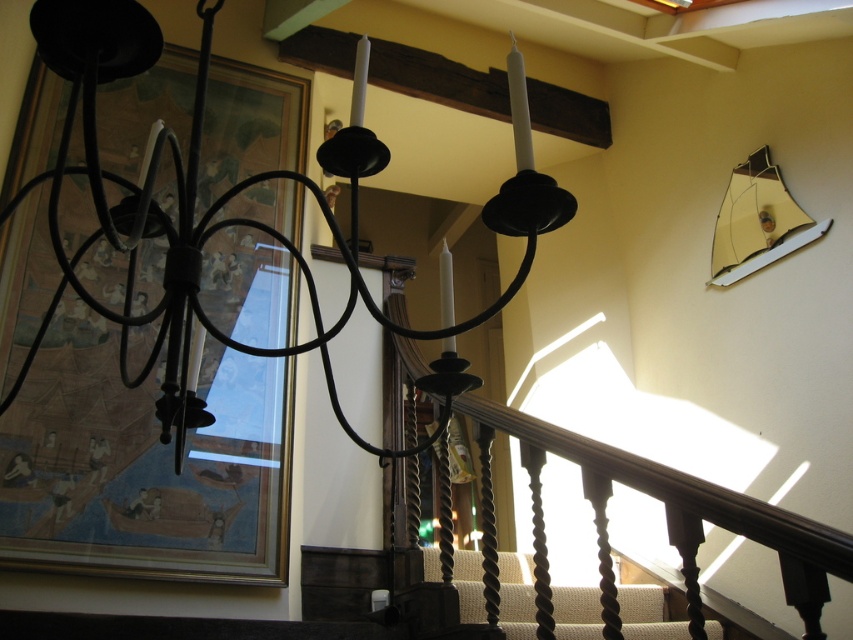
Is dark wood stair at center closer to camera compared to gold mirrored sailboat at upper right?

Yes, it is.

Is dark wood stair at center taller than gold mirrored sailboat at upper right?

No, dark wood stair at center is not taller than gold mirrored sailboat at upper right.

Locate an element on the screen. dark wood stair at center is located at coordinates (515, 595).

Which of these two, wooden framed picture at upper left or matte black chandelier at upper center, stands taller?

wooden framed picture at upper left

Between point (44, 100) and point (350, 282), which one is positioned in front?

Point (350, 282)

You are a GUI agent. You are given a task and a screenshot of the screen. Output one action in this format:
    pyautogui.click(x=<x>, y=<y>)
    Task: Click on the wooden framed picture at upper left
    
    Given the screenshot: What is the action you would take?
    pyautogui.click(x=143, y=464)

Can you confirm if wooden framed picture at upper left is positioned to the right of gold mirrored sailboat at upper right?

Incorrect, wooden framed picture at upper left is not on the right side of gold mirrored sailboat at upper right.

Measure the distance between point [86,550] and camera.

Point [86,550] and camera are 7.76 feet apart from each other.

Where is `wooden framed picture at upper left`? wooden framed picture at upper left is located at coordinates (143, 464).